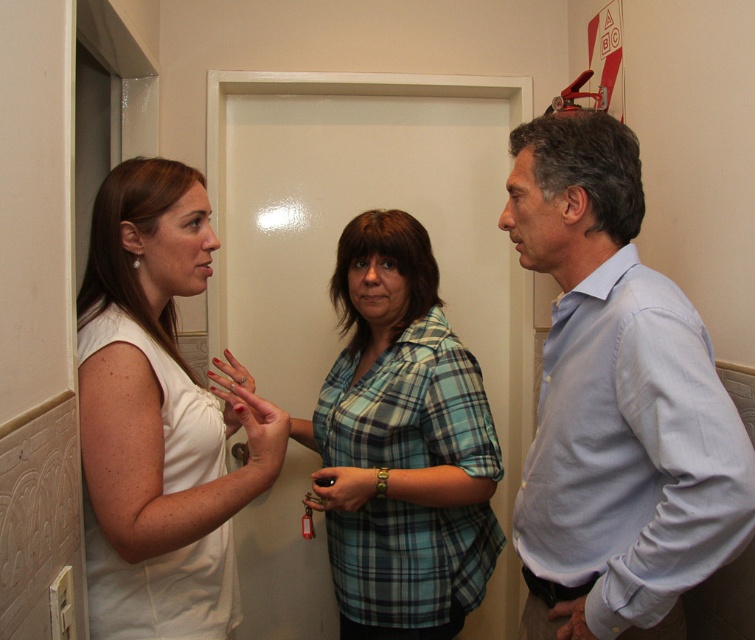
Question: Which of the following is the farthest from the observer?

Choices:
 (A) (393, 412)
 (B) (566, 605)
 (C) (322, 472)
 (D) (276, 449)

Answer: (A)

Question: Which of the following is the closest to the observer?

Choices:
 (A) (230, 390)
 (B) (122, 465)
 (C) (590, 204)
 (D) (575, 616)

Answer: (B)

Question: Can you confirm if white matte dress at left is positioned to the right of matte white hand at center?

Choices:
 (A) yes
 (B) no

Answer: (B)

Question: Is white matte dress at left to the left of matte brown leather wallet at center from the viewer's perspective?

Choices:
 (A) no
 (B) yes

Answer: (B)

Question: Considering the real-world distances, which object is farthest from the plaid fabric shirt at center?

Choices:
 (A) matte brown leather wallet at center
 (B) light blue shirt at center
 (C) white matte dress at left

Answer: (C)

Question: Is light blue shirt at center smaller than plaid fabric shirt at center?

Choices:
 (A) no
 (B) yes

Answer: (B)